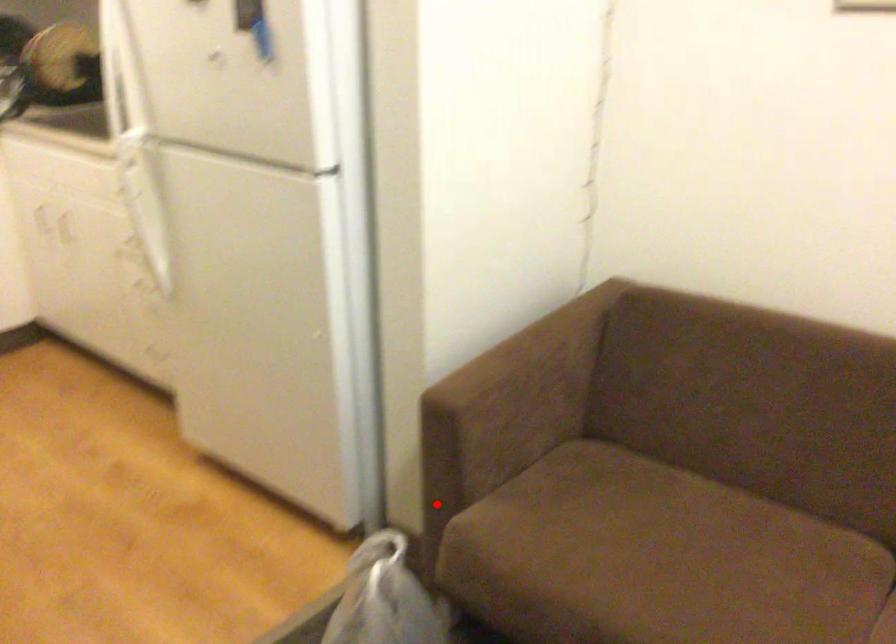
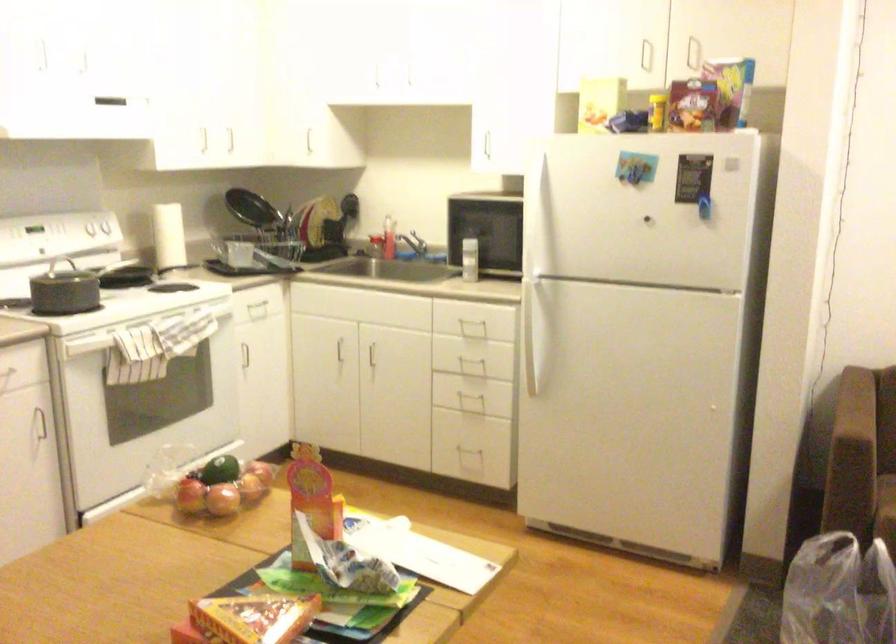
Question: I am providing you with two images of the same scene from different viewpoints. Given a red point in image1, look at the same physical point in image2. Is it:

Choices:
 (A) Closer to the viewpoint
 (B) Farther from the viewpoint

Answer: (B)